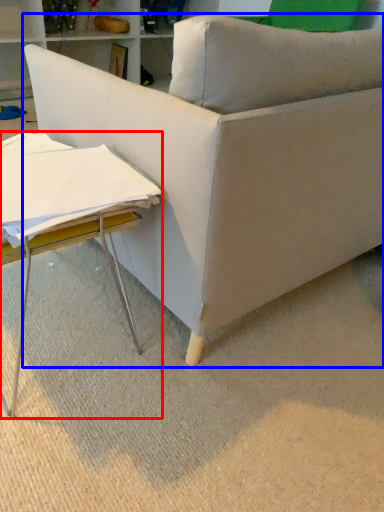
Question: Which point is further to the camera, table (highlighted by a red box) or studio couch (highlighted by a blue box)?

Choices:
 (A) table
 (B) studio couch

Answer: (A)